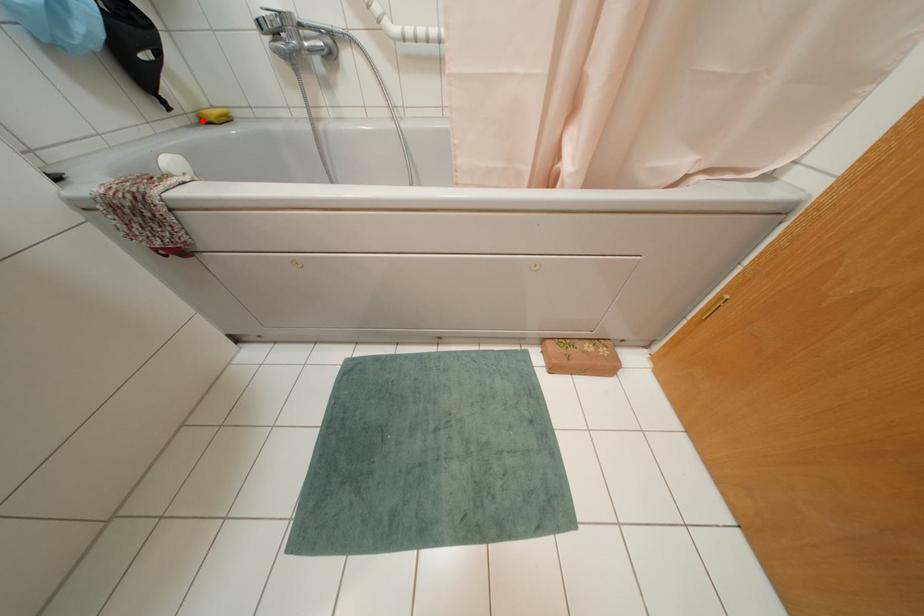
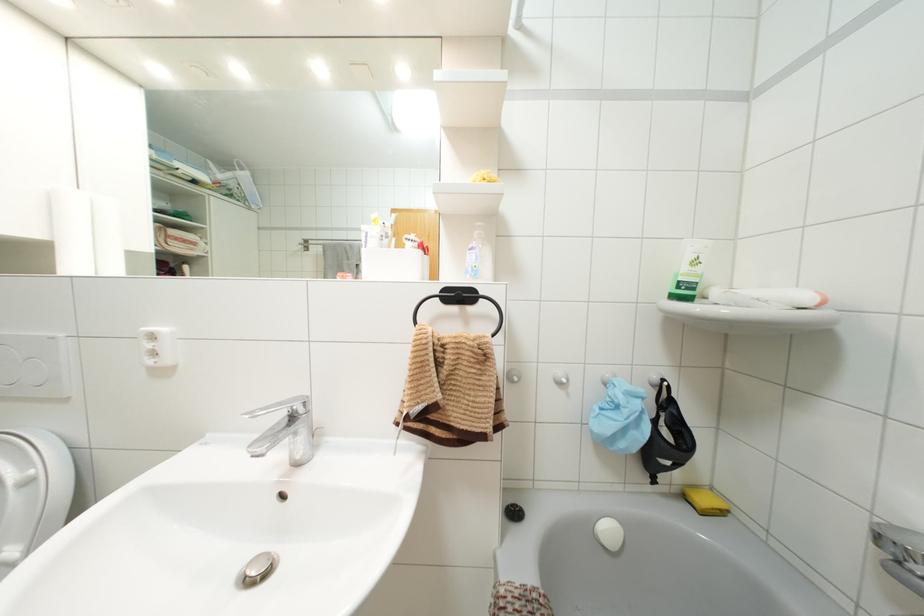
Where in the second image is the point corresponding to the highlighted location from the first image?

(685, 496)